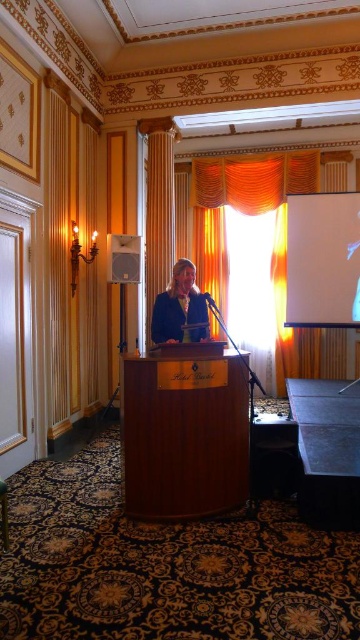
Does point (234, 492) come behind point (330, 264)?

That is False.

Does wooden podium at center appear on the left side of white glossy projection screen at upper right?

Yes, wooden podium at center is to the left of white glossy projection screen at upper right.

Where is `wooden podium at center`? This screenshot has width=360, height=640. wooden podium at center is located at coordinates (183, 435).

Does wooden podium at center appear on the left side of matte white speaker at upper center?

No, wooden podium at center is not to the left of matte white speaker at upper center.

Who is taller, wooden podium at center or matte white speaker at upper center?

Standing taller between the two is wooden podium at center.

Where is `wooden podium at center`? This screenshot has width=360, height=640. wooden podium at center is located at coordinates (183, 435).

Does white glossy projection screen at upper right have a lesser height compared to matte blue blazer at center?

No.

Does white glossy projection screen at upper right have a lesser width compared to matte blue blazer at center?

In fact, white glossy projection screen at upper right might be wider than matte blue blazer at center.

Between point (317, 227) and point (178, 320), which one is positioned in front?

Point (178, 320) is in front.

Identify the location of white glossy projection screen at upper right. (322, 260).